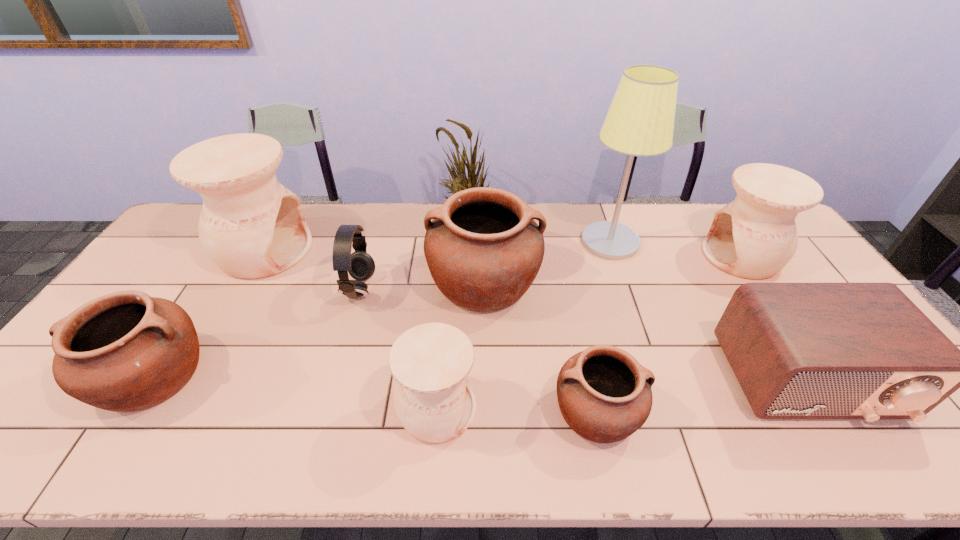
The image size is (960, 540). I want to click on free space that satisfies the following two spatial constraints: 1. on the ear cups of the smallest reddish pottery; 2. on the left side of the black earphone, so click(325, 411).

Find the location of a particular element. This screenshot has height=540, width=960. free spot that satisfies the following two spatial constraints: 1. at the open side of the shortest object; 2. on the right side of the biggest cream pottery is located at coordinates (174, 411).

Locate an element on the screen. The width and height of the screenshot is (960, 540). blank area in the image that satisfies the following two spatial constraints: 1. on the back side of the shortest object; 2. at the open side of the tallest pottery is located at coordinates (563, 250).

The width and height of the screenshot is (960, 540). I want to click on free spot that satisfies the following two spatial constraints: 1. on the back side of the second biggest reddish pottery; 2. on the right side of the tallest object, so click(x=238, y=241).